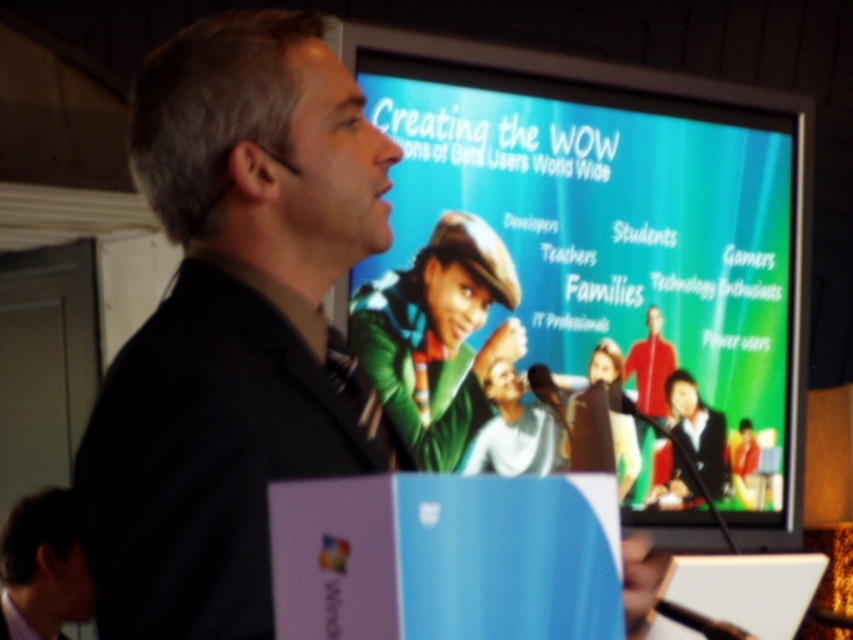
Is black matte suit at center wider than white matte shirt at center?

Yes.

Is point (160, 410) more distant than point (531, 468)?

No, (160, 410) is closer to viewer.

Locate an element on the screen. This screenshot has width=853, height=640. black matte suit at center is located at coordinates (234, 324).

Is black matte suit at center in front of matte black shirt at lower left?

Yes, black matte suit at center is in front of matte black shirt at lower left.

Can you confirm if black matte suit at center is smaller than matte black shirt at lower left?

No, black matte suit at center is not smaller than matte black shirt at lower left.

Does point (115, 628) lie in front of point (64, 592)?

Yes.

Identify the location of black matte suit at center. (234, 324).

Does black matte suit at center appear on the left side of white plastic laptop at center?

Correct, you'll find black matte suit at center to the left of white plastic laptop at center.

What do you see at coordinates (234, 324) in the screenshot? I see `black matte suit at center` at bounding box center [234, 324].

This screenshot has height=640, width=853. I want to click on black matte suit at center, so click(x=234, y=324).

What are the coordinates of `black matte suit at center` in the screenshot? It's located at (234, 324).